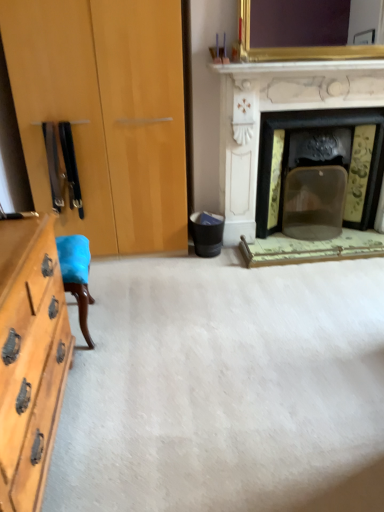
The width and height of the screenshot is (384, 512). What do you see at coordinates (278, 111) in the screenshot?
I see `white marble fireplace at right` at bounding box center [278, 111].

At what (x,y) coordinates should I click in order to perform the action: click on white marble fireplace at right. Please return your answer as a coordinate pair (x, y). This screenshot has height=512, width=384. Looking at the image, I should click on (278, 111).

The height and width of the screenshot is (512, 384). I want to click on white marble fireplace at right, so click(278, 111).